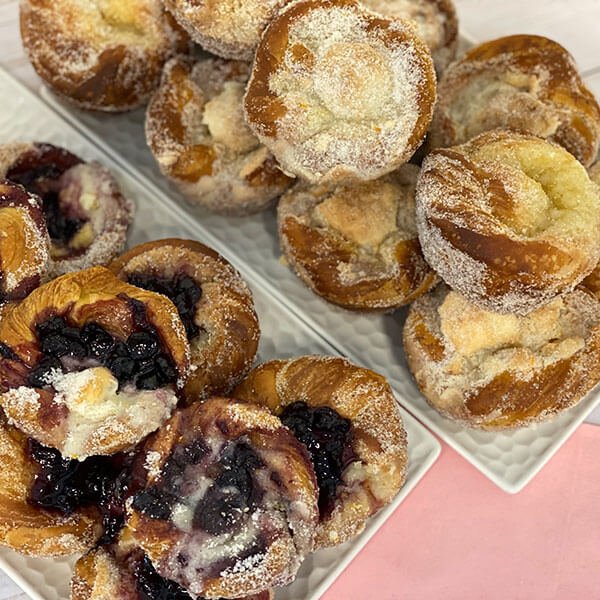
Where is `placemat`? The height and width of the screenshot is (600, 600). placemat is located at coordinates (511, 516).